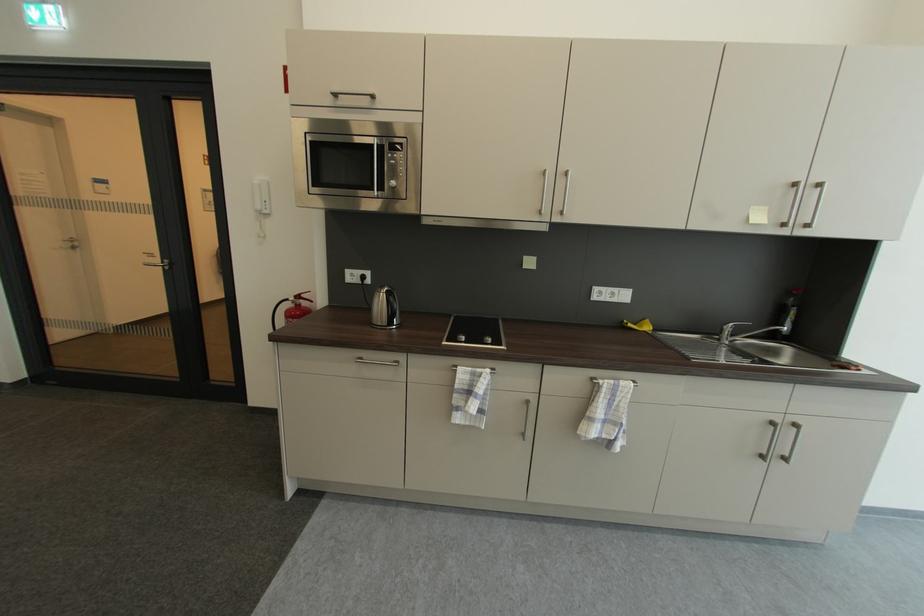
What do you see at coordinates (261, 198) in the screenshot? I see `the white phone handset` at bounding box center [261, 198].